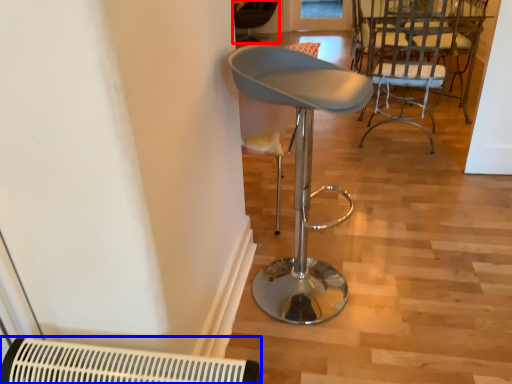
Question: Which of the following is the closest to the observer, chair (highlighted by a red box) or air conditioning (highlighted by a blue box)?

Choices:
 (A) chair
 (B) air conditioning

Answer: (B)